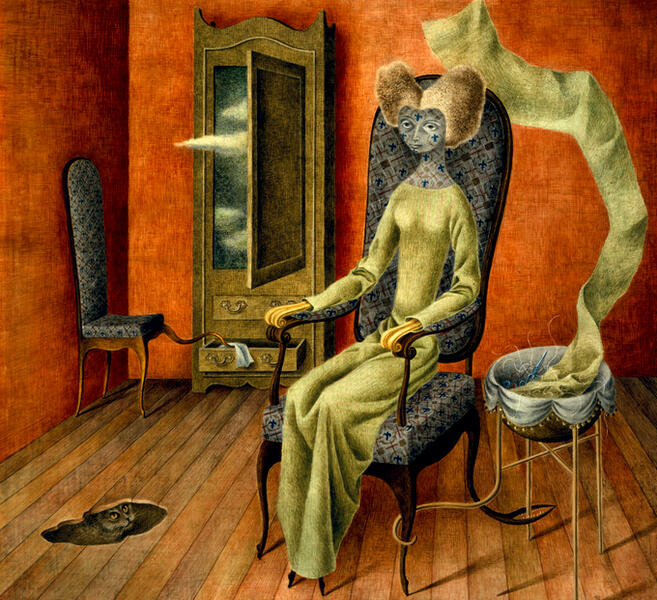
This screenshot has width=657, height=600. Find the location of `wardrobe`. wardrobe is located at coordinates (265, 160).